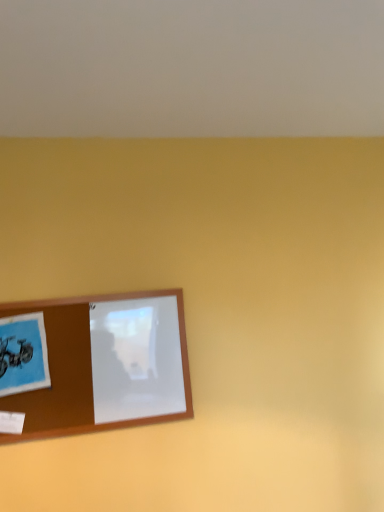
Measure the distance between point (53, 431) and camera.

Point (53, 431) is 4.10 feet away from camera.

This screenshot has width=384, height=512. Identify the location of brown wooden picture frame at lower left. (95, 362).

The height and width of the screenshot is (512, 384). What do you see at coordinates (95, 362) in the screenshot?
I see `brown wooden picture frame at lower left` at bounding box center [95, 362].

The width and height of the screenshot is (384, 512). What do you see at coordinates (23, 354) in the screenshot?
I see `blue matte postcard at lower left` at bounding box center [23, 354].

Measure the distance between blue matte postcard at lower left and camera.

4.03 feet.

The image size is (384, 512). Find the location of `blue matte postcard at lower left`. blue matte postcard at lower left is located at coordinates (23, 354).

Identify the location of brown wooden picture frame at lower left. (95, 362).

Which object is positioned more to the right, blue matte postcard at lower left or brown wooden picture frame at lower left?

brown wooden picture frame at lower left.

Is the depth of blue matte postcard at lower left greater than that of brown wooden picture frame at lower left?

No, blue matte postcard at lower left is closer to the camera.

Considering the points (42, 322) and (5, 319), which point is behind, point (42, 322) or point (5, 319)?

Point (42, 322)

From the image's perspective, does blue matte postcard at lower left appear lower than brown wooden picture frame at lower left?

Actually, blue matte postcard at lower left appears above brown wooden picture frame at lower left in the image.

From a real-world perspective, which object rests below the other?

brown wooden picture frame at lower left is physically lower.

Which object is wider, blue matte postcard at lower left or brown wooden picture frame at lower left?

Wider between the two is blue matte postcard at lower left.

Who is shorter, blue matte postcard at lower left or brown wooden picture frame at lower left?

blue matte postcard at lower left is shorter.

Between blue matte postcard at lower left and brown wooden picture frame at lower left, which one has smaller size?

blue matte postcard at lower left.

Does blue matte postcard at lower left contain brown wooden picture frame at lower left?

No, brown wooden picture frame at lower left is not inside blue matte postcard at lower left.

Can you see blue matte postcard at lower left touching brown wooden picture frame at lower left?

They are not placed beside each other.

Is blue matte postcard at lower left oriented away from brown wooden picture frame at lower left?

That's right, blue matte postcard at lower left is facing away from brown wooden picture frame at lower left.

How much distance is there between blue matte postcard at lower left and brown wooden picture frame at lower left?

They are 5.48 inches apart.

Locate an element on the screen. picture frame below the blue matte postcard at lower left (from the image's perspective) is located at coordinates (95, 362).

In the image, is brown wooden picture frame at lower left on the left side or the right side of blue matte postcard at lower left?

Based on their positions, brown wooden picture frame at lower left is located to the right of blue matte postcard at lower left.

Is the depth of brown wooden picture frame at lower left greater than that of blue matte postcard at lower left?

Yes, brown wooden picture frame at lower left is further from the viewer.

Which point is more distant from viewer, (168, 310) or (19, 342)?

The point (168, 310) is more distant.

From the image's perspective, which is below, brown wooden picture frame at lower left or blue matte postcard at lower left?

From the image's view, brown wooden picture frame at lower left is below.

From a real-world perspective, is brown wooden picture frame at lower left above or below blue matte postcard at lower left?

brown wooden picture frame at lower left is below blue matte postcard at lower left.

In terms of width, does brown wooden picture frame at lower left look wider or thinner when compared to blue matte postcard at lower left?

Considering their sizes, brown wooden picture frame at lower left looks slimmer than blue matte postcard at lower left.

Between brown wooden picture frame at lower left and blue matte postcard at lower left, which one has less height?

blue matte postcard at lower left.

Between brown wooden picture frame at lower left and blue matte postcard at lower left, which one has smaller size?

Smaller between the two is blue matte postcard at lower left.

Is brown wooden picture frame at lower left completely or partially outside of blue matte postcard at lower left?

brown wooden picture frame at lower left is positioned outside blue matte postcard at lower left.

Is there a large distance between brown wooden picture frame at lower left and blue matte postcard at lower left?

They are positioned close to each other.

In the scene shown: Does brown wooden picture frame at lower left turn towards blue matte postcard at lower left?

Yes, brown wooden picture frame at lower left is aimed at blue matte postcard at lower left.

Where is `postcard on the left of brown wooden picture frame at lower left`? postcard on the left of brown wooden picture frame at lower left is located at coordinates (23, 354).

Where is `postcard that is in front of the brown wooden picture frame at lower left`? The width and height of the screenshot is (384, 512). postcard that is in front of the brown wooden picture frame at lower left is located at coordinates (23, 354).

In the image, there is a brown wooden picture frame at lower left. Where is `postcard above it (from the image's perspective)`? The width and height of the screenshot is (384, 512). postcard above it (from the image's perspective) is located at coordinates 23,354.